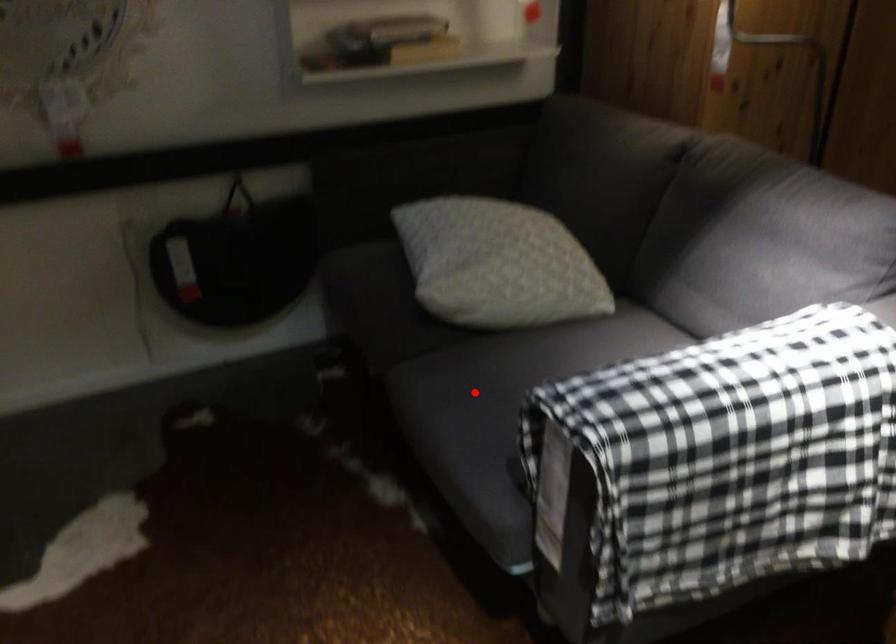
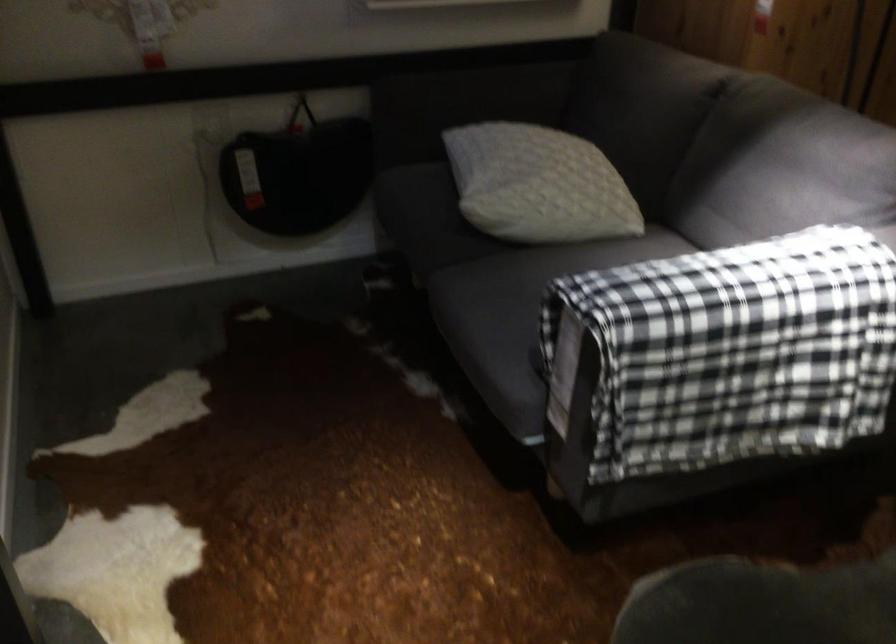
In the second image, find the point that corresponds to the highlighted location in the first image.

(504, 292)